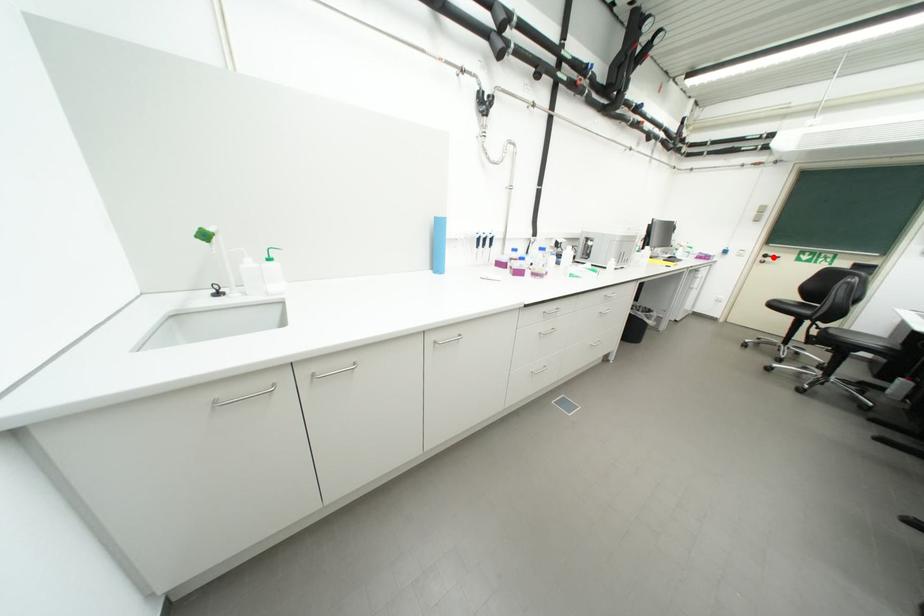
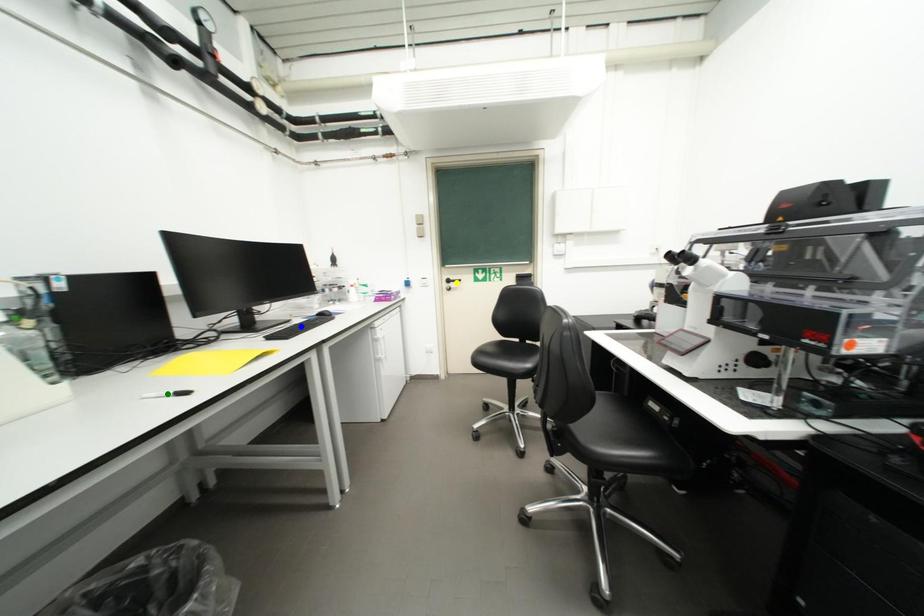
Question: I am providing you with two images of the same scene from different viewpoints. A red point is marked on the first image. You are given multiple points on the second image. Which point in image 2 is actually the same real-world point as the red point in image 1?

Choices:
 (A) blue point
 (B) green point
 (C) yellow point

Answer: (C)